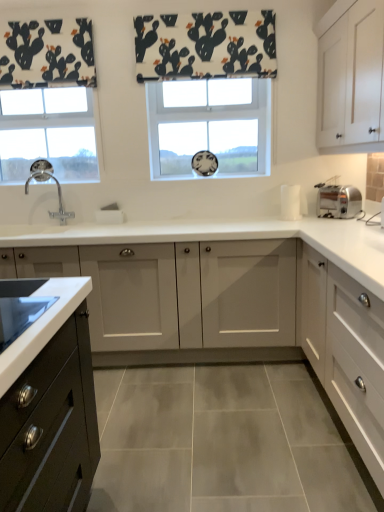
Question: Is white matte cabinet at right, the 1th cabinetry in the bottom-to-top sequence, in contact with white matte cabinet at center, the 2th cabinetry in the top-to-bottom sequence?

Choices:
 (A) yes
 (B) no

Answer: (B)

Question: Is white matte cabinet at center, the 2th cabinetry in the top-to-bottom sequence, completely or partially inside white matte cabinet at right, the 1th cabinetry in the bottom-to-top sequence?

Choices:
 (A) yes
 (B) no

Answer: (B)

Question: Can you confirm if white matte cabinet at right, the 1th cabinetry in the bottom-to-top sequence, is wider than white matte cabinet at center, the third cabinetry ordered from the bottom?

Choices:
 (A) yes
 (B) no

Answer: (B)

Question: Is the position of white matte cabinet at right, the 1th cabinetry in the bottom-to-top sequence, more distant than that of white matte cabinet at center, the third cabinetry ordered from the bottom?

Choices:
 (A) no
 (B) yes

Answer: (A)

Question: Does white matte cabinet at right, the 1th cabinetry in the bottom-to-top sequence, have a lesser height compared to white matte cabinet at center, the 2th cabinetry in the top-to-bottom sequence?

Choices:
 (A) yes
 (B) no

Answer: (A)

Question: Can you confirm if white matte cabinet at right, the fourth cabinetry viewed from the top, is thinner than white matte cabinet at center, the 2th cabinetry in the top-to-bottom sequence?

Choices:
 (A) yes
 (B) no

Answer: (A)

Question: Is white glass window at center, which is counted as the first window, starting from the right, bigger than clear glass window at left, marked as the 2th window in a right-to-left arrangement?

Choices:
 (A) no
 (B) yes

Answer: (A)

Question: Does white glass window at center, the 2th window from the left, have a lesser width compared to clear glass window at left, placed as the 1th window when sorted from left to right?

Choices:
 (A) no
 (B) yes

Answer: (B)

Question: Is white glass window at center, which is counted as the first window, starting from the right, smaller than clear glass window at left, marked as the 2th window in a right-to-left arrangement?

Choices:
 (A) yes
 (B) no

Answer: (A)

Question: From the image's perspective, does white glass window at center, which is counted as the first window, starting from the right, appear higher than clear glass window at left, placed as the 1th window when sorted from left to right?

Choices:
 (A) yes
 (B) no

Answer: (A)

Question: Does white glass window at center, the 2th window from the left, lie in front of clear glass window at left, marked as the 2th window in a right-to-left arrangement?

Choices:
 (A) no
 (B) yes

Answer: (A)

Question: Is white glass window at center, which is counted as the first window, starting from the right, shorter than clear glass window at left, placed as the 1th window when sorted from left to right?

Choices:
 (A) yes
 (B) no

Answer: (B)

Question: From a real-world perspective, does white matte cabinet at upper right, the 1th cabinetry when ordered from top to bottom, sit lower than polished chrome faucet at left?

Choices:
 (A) no
 (B) yes

Answer: (A)